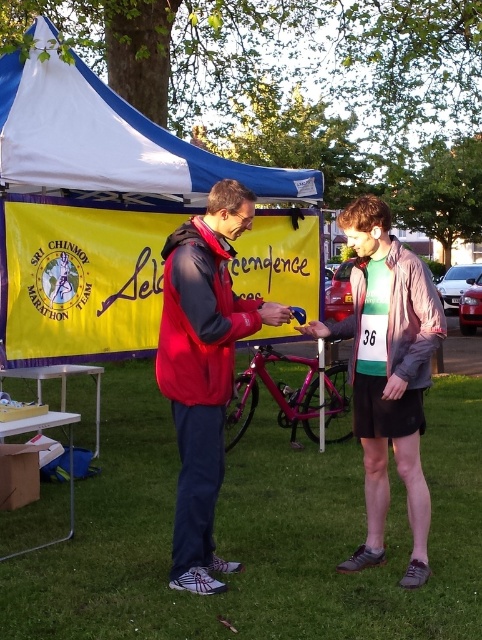
You are standing at the SRI CHINMOY MARATHON TEAM event under the blue and white canopy tent. There are two points marked in the image. The first point is at coordinates point [178,540] and the second point is at point [412,289]. If you are facing the banner, which point is closer to you?

Point [178,540] is in front of point [412,289], so it is closer to you when facing the banner.

Based on the scene description, what are the coordinates of the red fleece jacket at center?

The coordinates of the red fleece jacket at center are at point (203, 369).